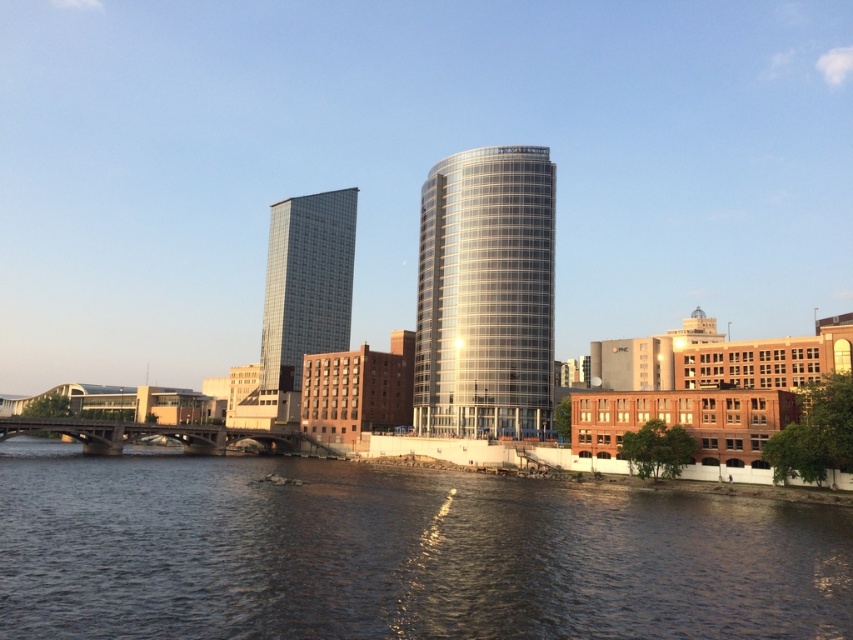
Question: Among these points, which one is nearest to the camera?

Choices:
 (A) (494, 168)
 (B) (294, 346)
 (C) (454, 636)

Answer: (C)

Question: Which point is farther to the camera?

Choices:
 (A) dark blue water at center
 (B) glassy reflective skyscraper at center

Answer: (B)

Question: Is shiny glass tower at center to the left of glassy reflective skyscraper at center from the viewer's perspective?

Choices:
 (A) yes
 (B) no

Answer: (B)

Question: Can you confirm if dark blue water at center is bigger than shiny glass tower at center?

Choices:
 (A) no
 (B) yes

Answer: (B)

Question: Which object is closer to the camera taking this photo?

Choices:
 (A) glassy reflective skyscraper at center
 (B) shiny glass tower at center
 (C) dark blue water at center

Answer: (C)

Question: Is dark blue water at center above shiny glass tower at center?

Choices:
 (A) yes
 (B) no

Answer: (B)